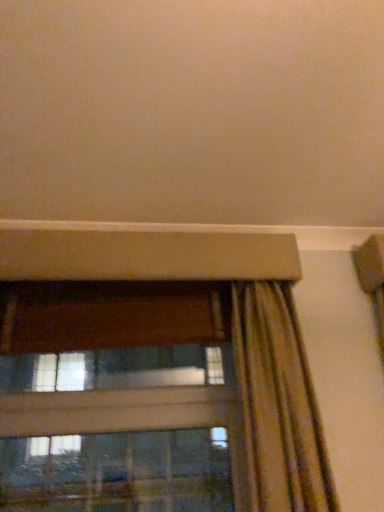
Where is `transparent glass window at lower left`? transparent glass window at lower left is located at coordinates (222, 409).

What is the approximate width of transparent glass window at lower left?

transparent glass window at lower left is 5.86 inches wide.

This screenshot has height=512, width=384. What do you see at coordinates (222, 409) in the screenshot?
I see `transparent glass window at lower left` at bounding box center [222, 409].

Measure the distance between point (x=278, y=344) and camera.

A distance of 4.19 feet exists between point (x=278, y=344) and camera.

Locate an element on the screen. striped fabric curtain at lower right is located at coordinates (278, 404).

What do you see at coordinates (278, 404) in the screenshot? I see `striped fabric curtain at lower right` at bounding box center [278, 404].

At what (x,y) coordinates should I click in order to perform the action: click on transparent glass window at lower left. Please return your answer as a coordinate pair (x, y). The image size is (384, 512). Looking at the image, I should click on [x=222, y=409].

Is striped fabric curtain at lower right to the right of transparent glass window at lower left from the viewer's perspective?

Correct, you'll find striped fabric curtain at lower right to the right of transparent glass window at lower left.

Which object is closer to the camera taking this photo, striped fabric curtain at lower right or transparent glass window at lower left?

striped fabric curtain at lower right is more forward.

Which point is more distant from viewer, [253,282] or [131,313]?

The point [131,313] is more distant.

From the image's perspective, relative to transparent glass window at lower left, is striped fabric curtain at lower right above or below?

Based on their image positions, striped fabric curtain at lower right is located above transparent glass window at lower left.

Based on the photo, from a real-world perspective, which is physically below, striped fabric curtain at lower right or transparent glass window at lower left?

From a 3D spatial view, transparent glass window at lower left is below.

Can you confirm if striped fabric curtain at lower right is thinner than transparent glass window at lower left?

Incorrect, the width of striped fabric curtain at lower right is not less than that of transparent glass window at lower left.

Looking at this image, does striped fabric curtain at lower right have a lesser height compared to transparent glass window at lower left?

In fact, striped fabric curtain at lower right may be taller than transparent glass window at lower left.

Considering the sizes of objects striped fabric curtain at lower right and transparent glass window at lower left in the image provided, who is bigger, striped fabric curtain at lower right or transparent glass window at lower left?

Bigger between the two is transparent glass window at lower left.

Is transparent glass window at lower left a part of striped fabric curtain at lower right?

No, transparent glass window at lower left is located outside of striped fabric curtain at lower right.

Is striped fabric curtain at lower right beside transparent glass window at lower left?

No, striped fabric curtain at lower right is not beside transparent glass window at lower left.

Is striped fabric curtain at lower right oriented towards transparent glass window at lower left?

No, striped fabric curtain at lower right does not turn towards transparent glass window at lower left.

How different are the orientations of striped fabric curtain at lower right and transparent glass window at lower left in degrees?

The angular difference between striped fabric curtain at lower right and transparent glass window at lower left is 0.000104 degrees.

How distant is striped fabric curtain at lower right from transparent glass window at lower left?

A distance of 4.39 inches exists between striped fabric curtain at lower right and transparent glass window at lower left.

This screenshot has width=384, height=512. Identify the location of window that appears below the striped fabric curtain at lower right (from a real-world perspective). (222, 409).

Can you confirm if transparent glass window at lower left is positioned to the right of striped fabric curtain at lower right?

No.

Which object is closer to the camera, transparent glass window at lower left or striped fabric curtain at lower right?

striped fabric curtain at lower right.

In the scene shown: Which is nearer, (73,414) or (277,347)?

The point (277,347) is more forward.

From the image's perspective, which object appears higher, transparent glass window at lower left or striped fabric curtain at lower right?

From the image's view, striped fabric curtain at lower right is above.

From a real-world perspective, is transparent glass window at lower left above or below striped fabric curtain at lower right?

transparent glass window at lower left is situated lower than striped fabric curtain at lower right in the real world.

Considering the sizes of transparent glass window at lower left and striped fabric curtain at lower right in the image, is transparent glass window at lower left wider or thinner than striped fabric curtain at lower right?

Considering their sizes, transparent glass window at lower left looks slimmer than striped fabric curtain at lower right.

Considering the sizes of transparent glass window at lower left and striped fabric curtain at lower right in the image, is transparent glass window at lower left taller or shorter than striped fabric curtain at lower right?

Considering their sizes, transparent glass window at lower left has less height than striped fabric curtain at lower right.

Considering the relative sizes of transparent glass window at lower left and striped fabric curtain at lower right in the image provided, is transparent glass window at lower left smaller than striped fabric curtain at lower right?

Incorrect, transparent glass window at lower left is not smaller in size than striped fabric curtain at lower right.

Could striped fabric curtain at lower right be considered to be inside transparent glass window at lower left?

No, striped fabric curtain at lower right is located outside of transparent glass window at lower left.

Is the surface of transparent glass window at lower left in direct contact with striped fabric curtain at lower right?

No, transparent glass window at lower left is not next to striped fabric curtain at lower right.

Is transparent glass window at lower left aimed at striped fabric curtain at lower right?

Yes, transparent glass window at lower left is aimed at striped fabric curtain at lower right.

What's the angular difference between transparent glass window at lower left and striped fabric curtain at lower right's facing directions?

transparent glass window at lower left and striped fabric curtain at lower right are facing 0.000104 degrees away from each other.

How distant is transparent glass window at lower left from striped fabric curtain at lower right?

transparent glass window at lower left is 4.39 inches from striped fabric curtain at lower right.

At what (x,y) coordinates should I click in order to perform the action: click on window directly beneath the striped fabric curtain at lower right (from a real-world perspective). Please return your answer as a coordinate pair (x, y). The height and width of the screenshot is (512, 384). Looking at the image, I should click on (x=222, y=409).

Where is `window below the striped fabric curtain at lower right (from the image's perspective)`? This screenshot has width=384, height=512. window below the striped fabric curtain at lower right (from the image's perspective) is located at coordinates (222, 409).

Locate an element on the screen. Image resolution: width=384 pixels, height=512 pixels. curtain on the right of the transparent glass window at lower left is located at coordinates (278, 404).